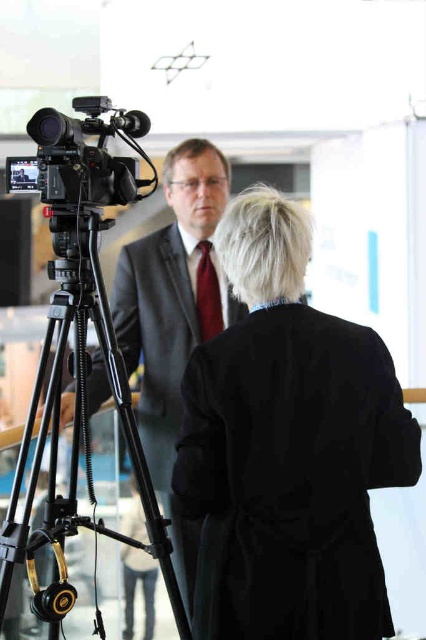
Question: Which object is the closest to the black matte camera at left?

Choices:
 (A) black rubber tripod at left
 (B) black matte coat at center

Answer: (A)

Question: Which is farther from the black matte camera at left?

Choices:
 (A) black rubber tripod at left
 (B) maroon silk tie at center
 (C) black matte coat at center

Answer: (B)

Question: Can you confirm if black rubber tripod at left is positioned below black matte camera at left?

Choices:
 (A) no
 (B) yes

Answer: (B)

Question: Which point appears closest to the camera in this image?

Choices:
 (A) (5, 547)
 (B) (367, 506)
 (C) (218, 323)

Answer: (B)

Question: Is black matte coat at center closer to camera compared to maroon silk tie at center?

Choices:
 (A) no
 (B) yes

Answer: (B)

Question: Is black rubber tripod at left positioned in front of maroon silk tie at center?

Choices:
 (A) yes
 (B) no

Answer: (A)